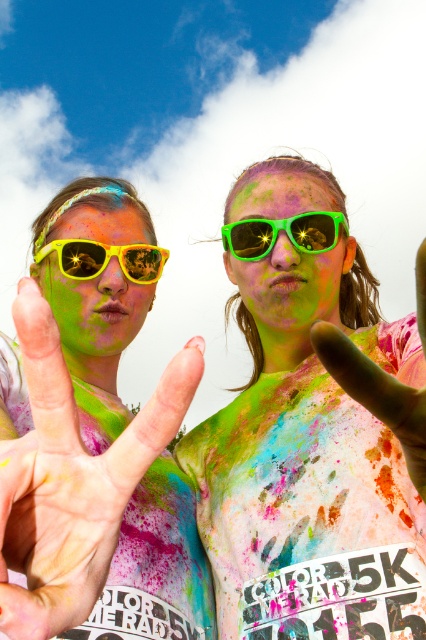
Question: Which object is closer to the camera taking this photo?

Choices:
 (A) yellow reflective sunglasses at center
 (B) green matte hand at center
 (C) green plastic goggles at center

Answer: (B)

Question: Can you confirm if yellow reflective sunglasses at center is smaller than green matte hand at center?

Choices:
 (A) yes
 (B) no

Answer: (B)

Question: Does matte yellow sunglasses at left have a lesser width compared to shiny yellow sunglasses at left?

Choices:
 (A) no
 (B) yes

Answer: (A)

Question: Which object is farther from the camera taking this photo?

Choices:
 (A) matte yellow sunglasses at left
 (B) green plastic goggles at center
 (C) shiny yellow sunglasses at left
 (D) yellow reflective sunglasses at center

Answer: (C)

Question: Which of the following is the farthest from the observer?

Choices:
 (A) green matte sunglasses at center
 (B) shiny yellow sunglasses at left
 (C) matte yellow sunglasses at left
 (D) green plastic goggles at center

Answer: (B)

Question: Is matte yellow sunglasses at left wider than green matte hand at center?

Choices:
 (A) no
 (B) yes

Answer: (B)